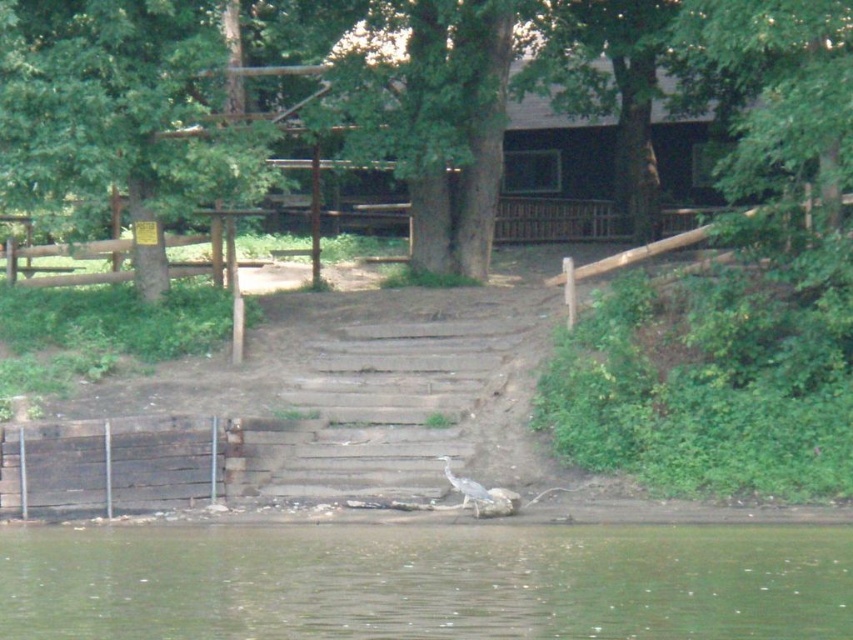
Question: Does green liquid water at lower center come behind gray matte bird at lower center?

Choices:
 (A) yes
 (B) no

Answer: (B)

Question: Which point is closer to the camera?

Choices:
 (A) green liquid water at lower center
 (B) gray matte bird at lower center
 (C) green leafy tree at upper left
 (D) weathered wood stairs at center

Answer: (A)

Question: Does green liquid water at lower center lie behind green leafy tree at upper left?

Choices:
 (A) yes
 (B) no

Answer: (B)

Question: Which object is farther from the camera taking this photo?

Choices:
 (A) weathered wood stairs at center
 (B) green leafy tree at upper left
 (C) green liquid water at lower center
 (D) gray matte bird at lower center

Answer: (B)

Question: Does weathered wood stairs at center appear on the right side of gray matte bird at lower center?

Choices:
 (A) yes
 (B) no

Answer: (B)

Question: Which object is the farthest from the gray matte bird at lower center?

Choices:
 (A) green leafy tree at upper left
 (B) weathered wood stairs at center

Answer: (A)